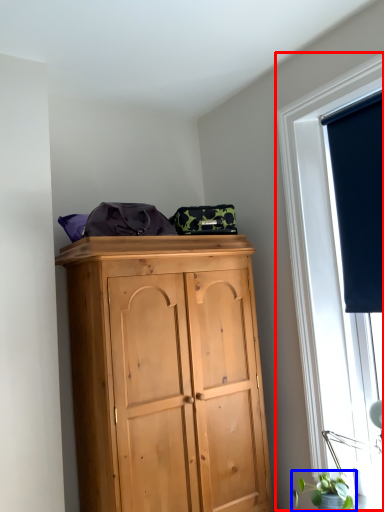
Question: Which point is further to the camera, window (highlighted by a red box) or plant (highlighted by a blue box)?

Choices:
 (A) window
 (B) plant

Answer: (A)